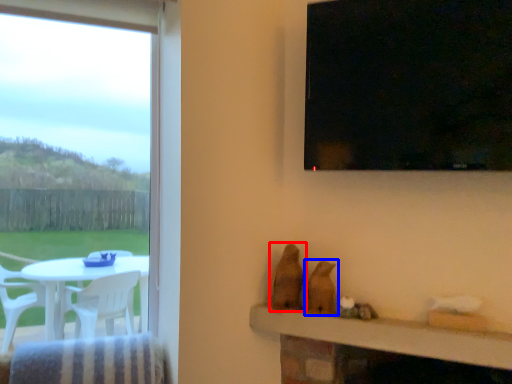
Question: Which object appears closest to the camera in this image, animal (highlighted by a red box) or animal (highlighted by a blue box)?

Choices:
 (A) animal
 (B) animal

Answer: (B)